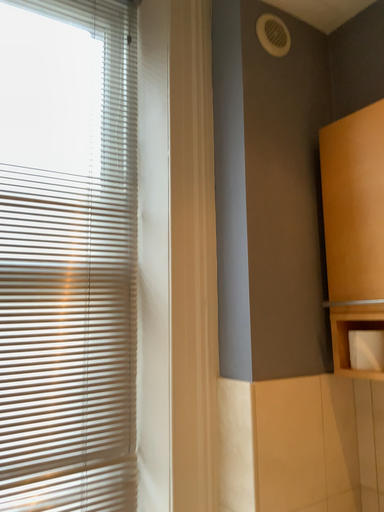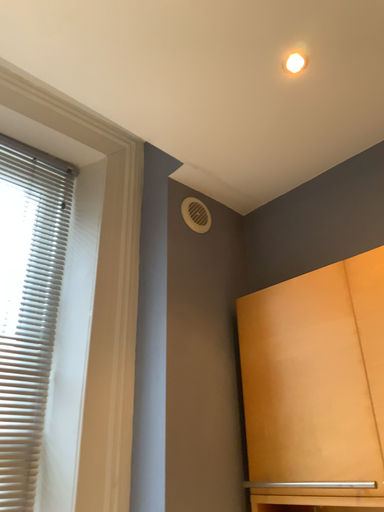
Question: Which way did the camera rotate in the video?

Choices:
 (A) rotated upward
 (B) rotated downward

Answer: (A)